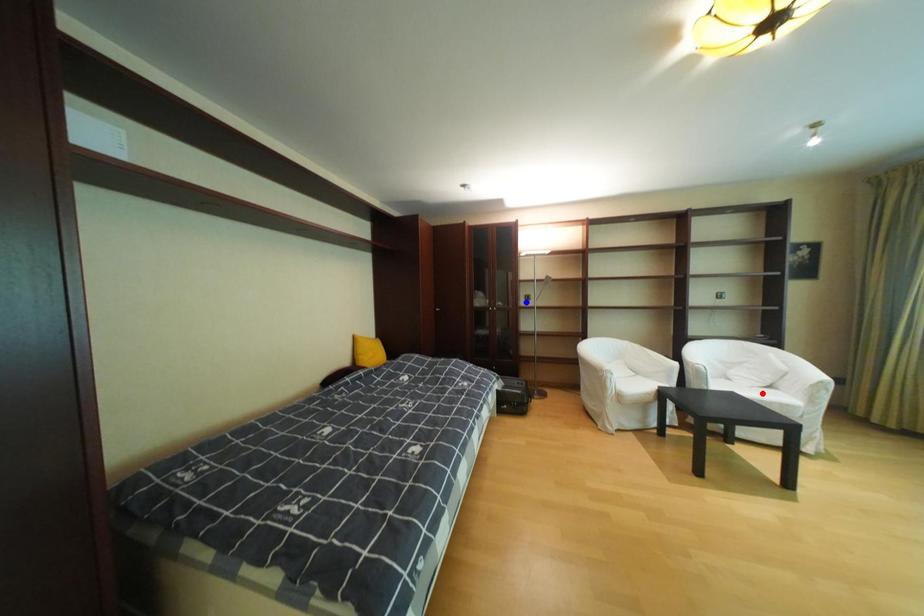
Question: Which of the two points in the image is closer to the camera?

Choices:
 (A) Blue point is closer.
 (B) Red point is closer.

Answer: (B)